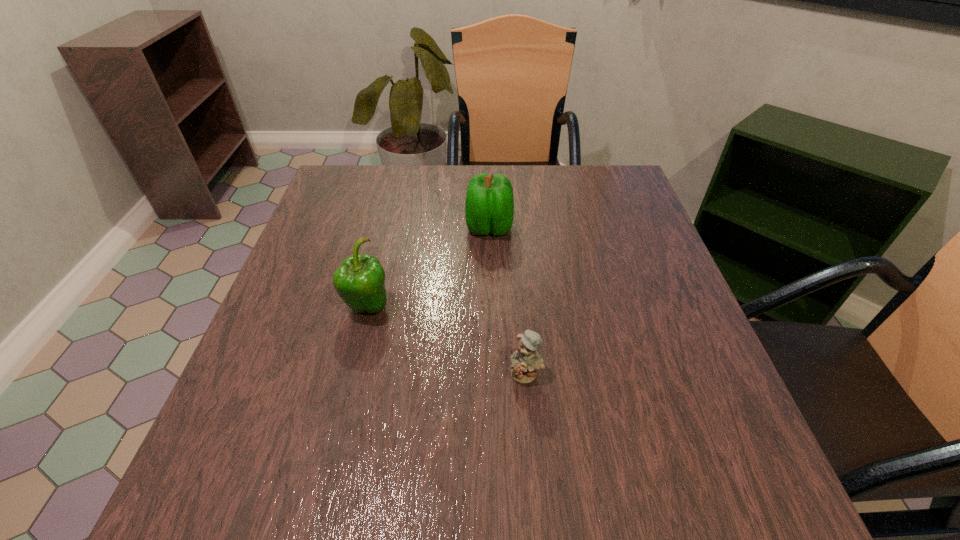
Where is `object present at the left edge`? object present at the left edge is located at coordinates pos(360,280).

Locate an element on the screen. The height and width of the screenshot is (540, 960). vacant space at the far edge is located at coordinates (427, 179).

You are a GUI agent. You are given a task and a screenshot of the screen. Output one action in this format:
    pyautogui.click(x=<x>, y=<y>)
    Task: Click on the free space at the near edge of the desktop
    Image resolution: width=960 pixels, height=540 pixels.
    Given the screenshot: What is the action you would take?
    pyautogui.click(x=407, y=481)

You are a GUI agent. You are given a task and a screenshot of the screen. Output one action in this format:
    pyautogui.click(x=<x>, y=<y>)
    Task: Click on the vacant space at the left edge
    The height and width of the screenshot is (540, 960).
    Given the screenshot: What is the action you would take?
    pyautogui.click(x=340, y=262)

In the image, there is a desktop. At what (x,y) coordinates should I click in order to perform the action: click on free region at the right edge. Please return your answer as a coordinate pair (x, y). The image size is (960, 540). Looking at the image, I should click on (710, 422).

In the image, there is a desktop. Identify the location of vacant space at the far left corner. (345, 166).

You are a GUI agent. You are given a task and a screenshot of the screen. Output one action in this format:
    pyautogui.click(x=<x>, y=<y>)
    Task: Click on the free region at the near left corner
    The image size is (960, 540).
    Given the screenshot: What is the action you would take?
    pyautogui.click(x=301, y=460)

The width and height of the screenshot is (960, 540). Identify the location of vacant region at the far right corner of the desktop. (636, 214).

You are a GUI agent. You are given a task and a screenshot of the screen. Output one action in this format:
    pyautogui.click(x=<x>, y=<y>)
    Task: Click on the empty space between the nearer bell pepper and the farther bell pepper
    The image size is (960, 540).
    Given the screenshot: What is the action you would take?
    pyautogui.click(x=428, y=267)

The width and height of the screenshot is (960, 540). I want to click on vacant space that's between the right bell pepper and the teddy bear, so click(x=508, y=301).